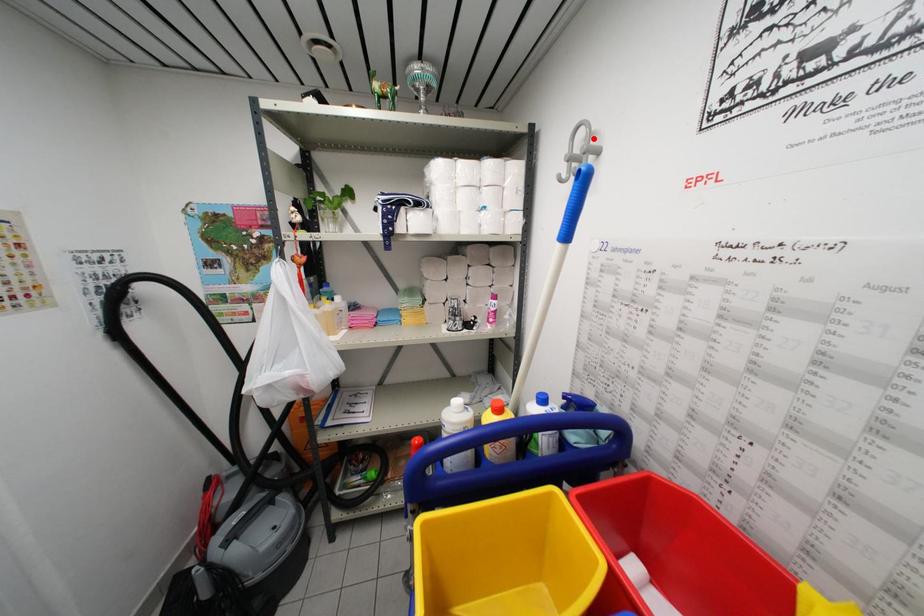
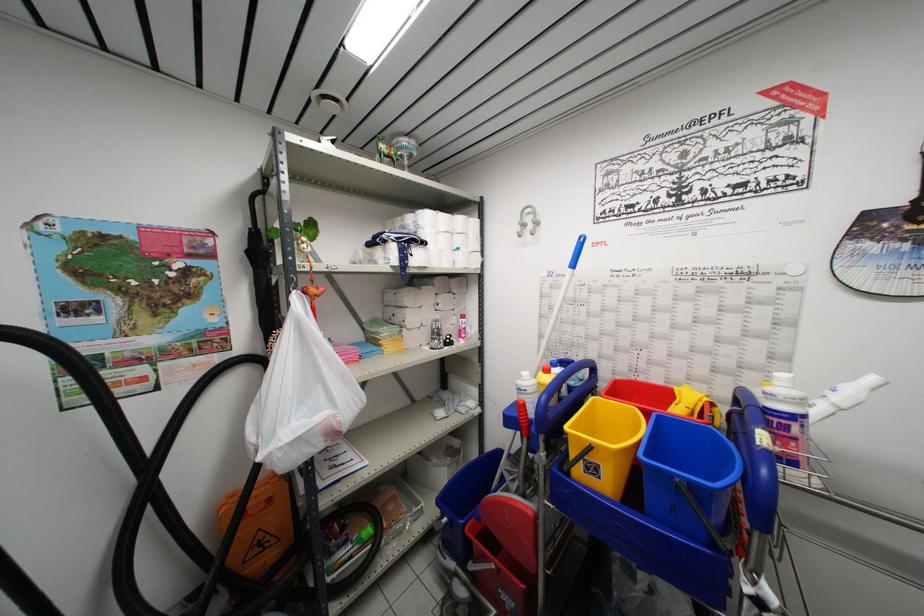
Question: I am providing you with two images of the same scene from different viewpoints. A red point is marked on the first image. Is the red point's position out of view in image 2?

Choices:
 (A) Yes
 (B) No

Answer: (B)